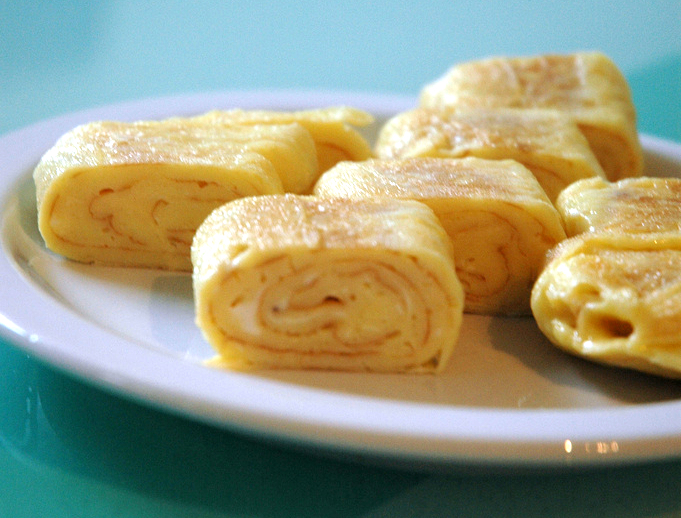
In order to click on table in this screenshot , I will do `click(104, 470)`.